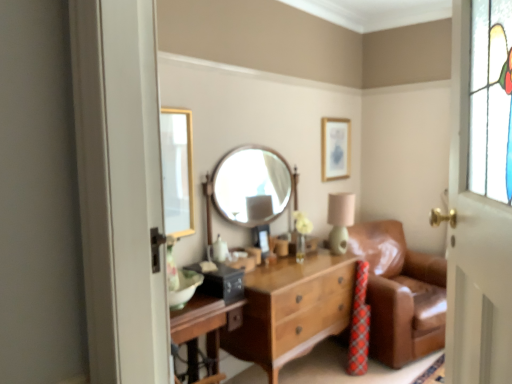
Question: Relative to gold metallic picture frame at upper center, is wooden round mirror at center in front or behind?

Choices:
 (A) front
 (B) behind

Answer: (A)

Question: In the image, is wooden round mirror at center on the left side or the right side of gold metallic picture frame at upper center?

Choices:
 (A) left
 (B) right

Answer: (A)

Question: Estimate the real-world distances between objects in this image. Which object is closer to the wooden round mirror at center?

Choices:
 (A) gold metallic picture frame at upper center
 (B) wooden chest of drawers at center
 (C) matte green table lamp at center
 (D) white painted wood door at right
 (E) brown leather couch at right

Answer: (C)

Question: Based on their relative distances, which object is farther from the wooden round mirror at center?

Choices:
 (A) white painted wood door at right
 (B) wooden chest of drawers at center
 (C) matte green table lamp at center
 (D) brown leather couch at right
 (E) gold metallic picture frame at upper center

Answer: (A)